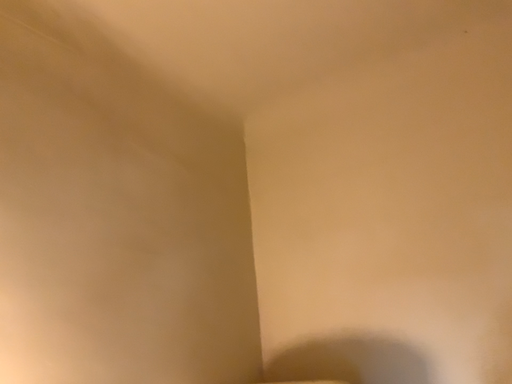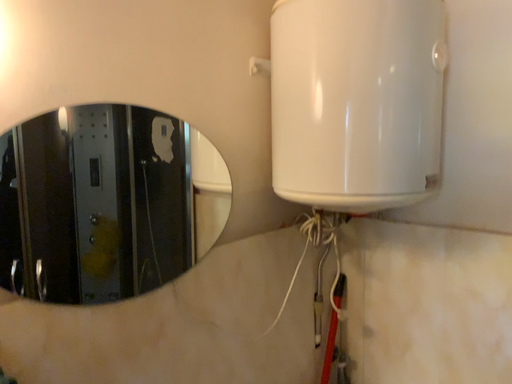
Question: How did the camera likely rotate when shooting the video?

Choices:
 (A) rotated downward
 (B) rotated upward

Answer: (A)